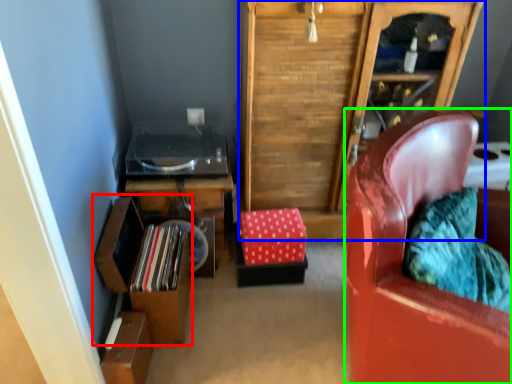
Question: Which is farther away from shelf (highlighted by a red box)? cabinetry (highlighted by a blue box) or chair (highlighted by a green box)?

Choices:
 (A) cabinetry
 (B) chair

Answer: (B)